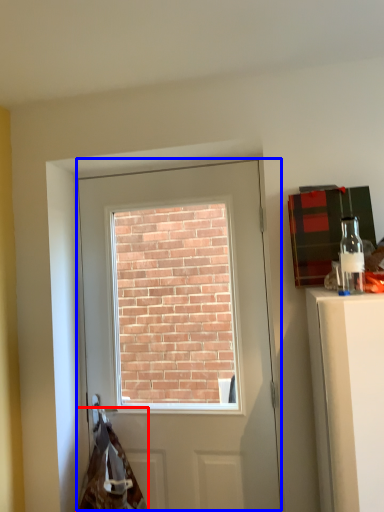
Question: Among these objects, which one is nearest to the camera, material (highlighted by a red box) or door (highlighted by a blue box)?

Choices:
 (A) material
 (B) door

Answer: (A)